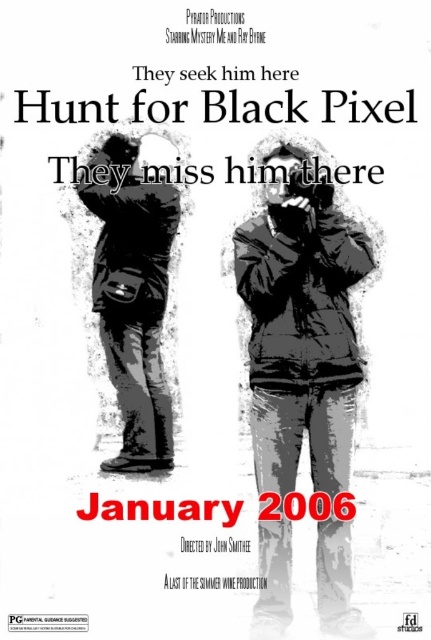
Question: Where is denim jacket at center located in relation to matte black bag at left in the image?

Choices:
 (A) left
 (B) right

Answer: (B)

Question: Which point is closer to the camera taking this photo?

Choices:
 (A) (334, 296)
 (B) (131, 280)

Answer: (A)

Question: Is denim jacket at center behind matte black bag at left?

Choices:
 (A) yes
 (B) no

Answer: (B)

Question: Does denim jacket at center appear over matte black bag at left?

Choices:
 (A) no
 (B) yes

Answer: (A)

Question: Which of the following is the farthest from the observer?

Choices:
 (A) matte black bag at left
 (B) denim jacket at center

Answer: (A)